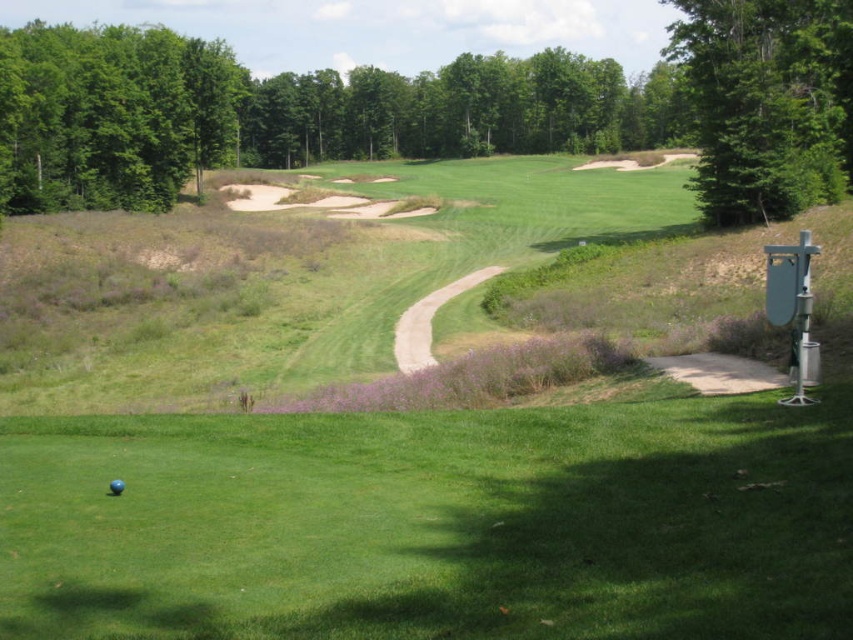
Question: Can you confirm if green leafy tree at upper right is positioned to the right of blue matte golf ball at lower left?

Choices:
 (A) no
 (B) yes

Answer: (B)

Question: Is the position of green leafy tree at upper left less distant than that of blue matte golf ball at lower left?

Choices:
 (A) yes
 (B) no

Answer: (B)

Question: Is green leafy tree at upper right below blue matte golf ball at lower left?

Choices:
 (A) no
 (B) yes

Answer: (A)

Question: Which point appears farthest from the camera in this image?

Choices:
 (A) (740, 54)
 (B) (199, 54)
 (C) (119, 493)

Answer: (B)

Question: Which object is the farthest from the green leafy tree at upper right?

Choices:
 (A) green leafy tree at upper left
 (B) blue matte golf ball at lower left

Answer: (A)

Question: Which object appears farthest from the camera in this image?

Choices:
 (A) blue matte golf ball at lower left
 (B) green leafy tree at upper right

Answer: (B)